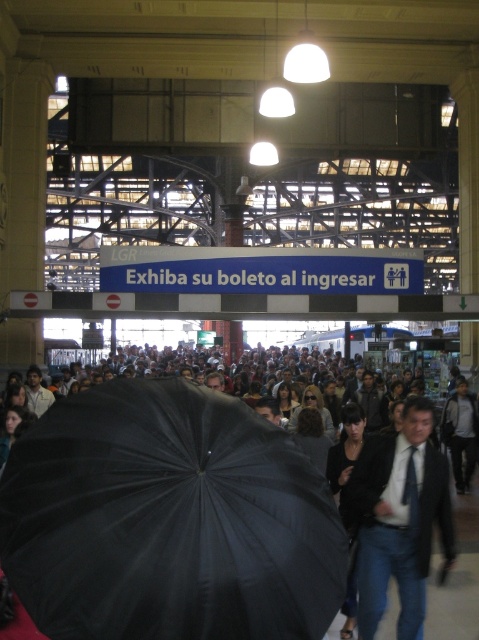
Between black matte umbrella at center and dark blue suit at center, which one appears on the right side from the viewer's perspective?

From the viewer's perspective, dark blue suit at center appears more on the right side.

Looking at this image, can you confirm if black matte umbrella at center is wider than dark blue suit at center?

Yes, black matte umbrella at center is wider than dark blue suit at center.

Is point (161, 566) positioned before point (408, 420)?

That is True.

At what (x,y) coordinates should I click in order to perform the action: click on black matte umbrella at center. Please return your answer as a coordinate pair (x, y). Looking at the image, I should click on (168, 518).